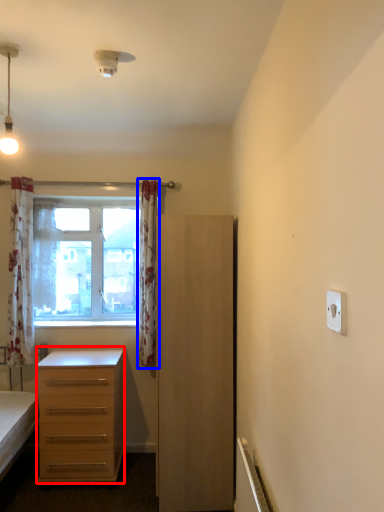
Question: Which object appears farthest to the camera in this image, desk (highlighted by a red box) or curtain (highlighted by a blue box)?

Choices:
 (A) desk
 (B) curtain

Answer: (B)